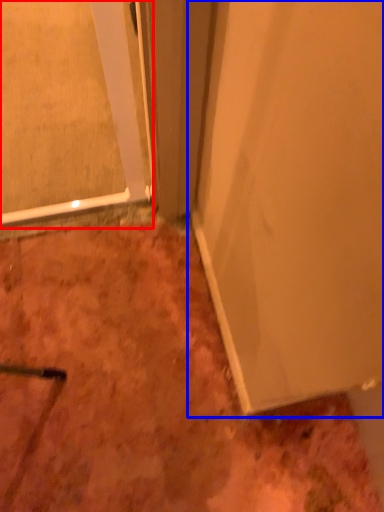
Question: Which of the following is the farthest to the observer, glass door (highlighted by a red box) or door (highlighted by a blue box)?

Choices:
 (A) glass door
 (B) door

Answer: (A)